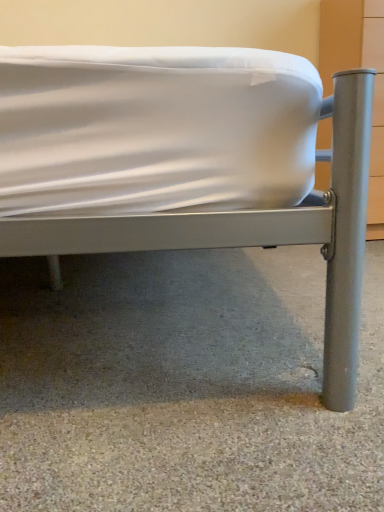
Measure the distance between metallic gray bed at center and camera.

51.83 centimeters.

What do you see at coordinates (187, 163) in the screenshot? I see `metallic gray bed at center` at bounding box center [187, 163].

The width and height of the screenshot is (384, 512). Find the location of `metallic gray bed at center`. metallic gray bed at center is located at coordinates (187, 163).

At what (x,y) coordinates should I click in order to perform the action: click on gray carpet at lower center. Please return your answer as a coordinate pair (x, y). The image size is (384, 512). Looking at the image, I should click on (184, 384).

What do you see at coordinates (184, 384) in the screenshot? I see `gray carpet at lower center` at bounding box center [184, 384].

Where is `metallic gray bed at center`? metallic gray bed at center is located at coordinates (187, 163).

Would you say metallic gray bed at center is to the left or to the right of gray carpet at lower center in the picture?

metallic gray bed at center is to the left of gray carpet at lower center.

Relative to gray carpet at lower center, is metallic gray bed at center in front or behind?

metallic gray bed at center is in front of gray carpet at lower center.

Which is further, (187,141) or (217,443)?

The point (217,443) is behind.

From the image's perspective, is metallic gray bed at center located above gray carpet at lower center?

Yes, from the image's perspective, metallic gray bed at center is over gray carpet at lower center.

From a real-world perspective, is metallic gray bed at center positioned under gray carpet at lower center based on gravity?

No.

Which object is wider, metallic gray bed at center or gray carpet at lower center?

Wider between the two is gray carpet at lower center.

Does metallic gray bed at center have a lesser height compared to gray carpet at lower center?

No, metallic gray bed at center is not shorter than gray carpet at lower center.

Is metallic gray bed at center bigger or smaller than gray carpet at lower center?

metallic gray bed at center is bigger than gray carpet at lower center.

Is metallic gray bed at center surrounding gray carpet at lower center?

No, gray carpet at lower center is not inside metallic gray bed at center.

Is metallic gray bed at center not close to gray carpet at lower center?

No, there isn't a large distance between metallic gray bed at center and gray carpet at lower center.

Is metallic gray bed at center aimed at gray carpet at lower center?

No, metallic gray bed at center is not turned towards gray carpet at lower center.

Can you tell me how much metallic gray bed at center and gray carpet at lower center differ in facing direction?

metallic gray bed at center and gray carpet at lower center are facing 91.2 degrees away from each other.

There is a gray carpet at lower center. Identify the location of bed above it (from a real-world perspective). Image resolution: width=384 pixels, height=512 pixels. (187, 163).

Can you confirm if gray carpet at lower center is positioned to the left of metallic gray bed at center?

No.

In the image, is gray carpet at lower center positioned in front of or behind metallic gray bed at center?

In the image, gray carpet at lower center appears behind metallic gray bed at center.

Does point (179, 310) appear closer or farther from the camera than point (3, 53)?

Point (179, 310) appears to be farther away from the viewer than point (3, 53).

From the image's perspective, which is above, gray carpet at lower center or metallic gray bed at center?

metallic gray bed at center, from the image's perspective.

From a real-world perspective, relative to metallic gray bed at center, is gray carpet at lower center vertically above or below?

gray carpet at lower center is situated lower than metallic gray bed at center in the real world.

Is gray carpet at lower center thinner than metallic gray bed at center?

No.

From their relative heights in the image, would you say gray carpet at lower center is taller or shorter than metallic gray bed at center?

Clearly, gray carpet at lower center is shorter compared to metallic gray bed at center.

Does gray carpet at lower center have a smaller size compared to metallic gray bed at center?

Yes, gray carpet at lower center is smaller than metallic gray bed at center.

Would you say gray carpet at lower center is inside or outside metallic gray bed at center?

gray carpet at lower center is spatially situated outside metallic gray bed at center.

Is there a large distance between gray carpet at lower center and metallic gray bed at center?

gray carpet at lower center is near metallic gray bed at center, not far away.

Is gray carpet at lower center looking in the opposite direction of metallic gray bed at center?

No, gray carpet at lower center is not facing away from metallic gray bed at center.

Can you tell me how much gray carpet at lower center and metallic gray bed at center differ in facing direction?

There is a 91.2-degree angle between the facing directions of gray carpet at lower center and metallic gray bed at center.

Where is `concrete on the right of metallic gray bed at center`? concrete on the right of metallic gray bed at center is located at coordinates (184, 384).

What are the coordinates of `bed located above the gray carpet at lower center (from the image's perspective)` in the screenshot? It's located at (187, 163).

This screenshot has width=384, height=512. What are the coordinates of `concrete below the metallic gray bed at center (from the image's perspective)` in the screenshot? It's located at (184, 384).